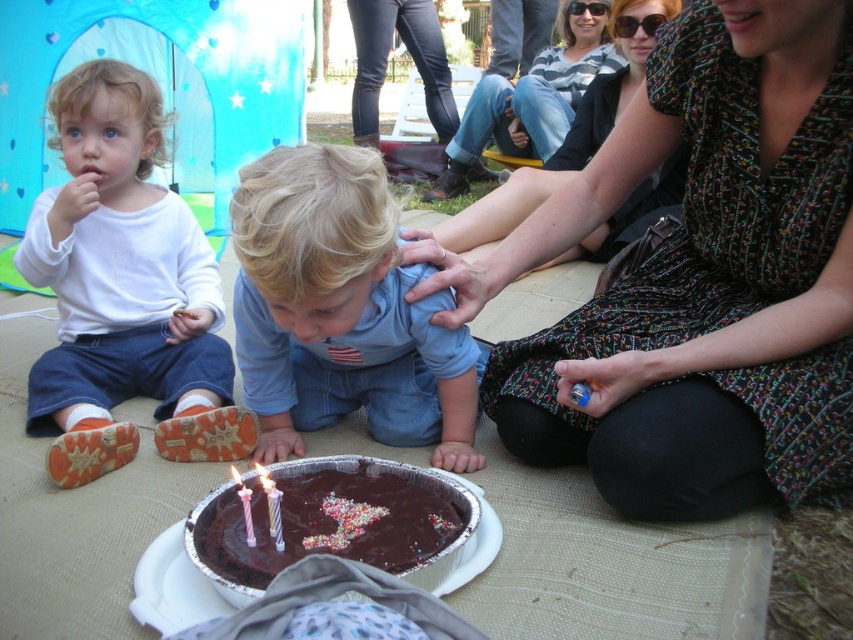
Can you confirm if printed fabric dress at center is positioned to the right of chocolatesmoothcake at lower center?

Correct, you'll find printed fabric dress at center to the right of chocolatesmoothcake at lower center.

Based on the photo, is the position of printed fabric dress at center less distant than that of chocolatesmoothcake at lower center?

No, it is not.

Identify the location of printed fabric dress at center. This screenshot has width=853, height=640. (699, 280).

Locate an element on the screen. The image size is (853, 640). printed fabric dress at center is located at coordinates (699, 280).

Between chocolatesmoothcake at lower center and pastel striped candle at center, which one appears on the right side from the viewer's perspective?

chocolatesmoothcake at lower center

Is point (323, 465) behind point (274, 488)?

Yes.

Is point (270, 548) more distant than point (271, 499)?

Yes, point (270, 548) is farther from viewer.

In order to click on chocolatesmoothcake at lower center in this screenshot , I will do `click(329, 522)`.

Is point (212, 556) farther from viewer compared to point (242, 486)?

No, (212, 556) is closer to viewer.

Can you confirm if chocolatesmoothcake at lower center is shorter than translucent plastic candle at center?

No, chocolatesmoothcake at lower center is not shorter than translucent plastic candle at center.

Find the location of a particular element. This screenshot has height=640, width=853. chocolatesmoothcake at lower center is located at coordinates (329, 522).

The image size is (853, 640). Identify the location of chocolatesmoothcake at lower center. (329, 522).